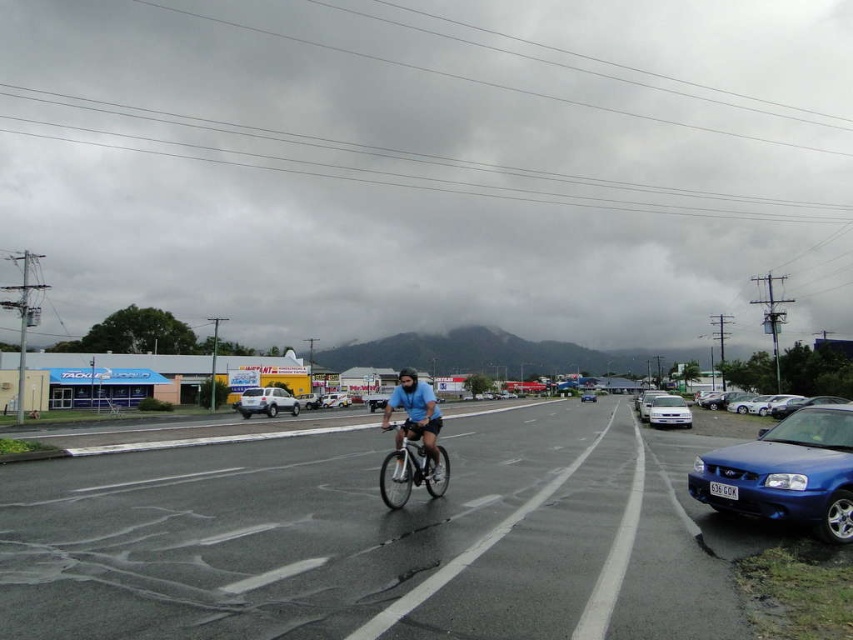
Question: Which point appears farthest from the camera in this image?

Choices:
 (A) (409, 436)
 (B) (809, 202)

Answer: (B)

Question: Does blue matte bicycle at center come in front of silver metallic sedan at center?

Choices:
 (A) no
 (B) yes

Answer: (B)

Question: Which is nearer to the blue matte bicycle at center?

Choices:
 (A) metallic blue sedan at right
 (B) gray cloudy sky at upper center
 (C) silver metallic sedan at center
 (D) shiny metallic bicycle at center

Answer: (D)

Question: Which object is positioned closest to the satin silver suv at center-left?

Choices:
 (A) silver metallic sedan at center
 (B) blue matte bicycle at center

Answer: (B)

Question: Is blue matte bicycle at center in front of satin silver suv at center-left?

Choices:
 (A) no
 (B) yes

Answer: (B)

Question: Does gray cloudy sky at upper center have a larger size compared to silver metallic sedan at center?

Choices:
 (A) no
 (B) yes

Answer: (B)